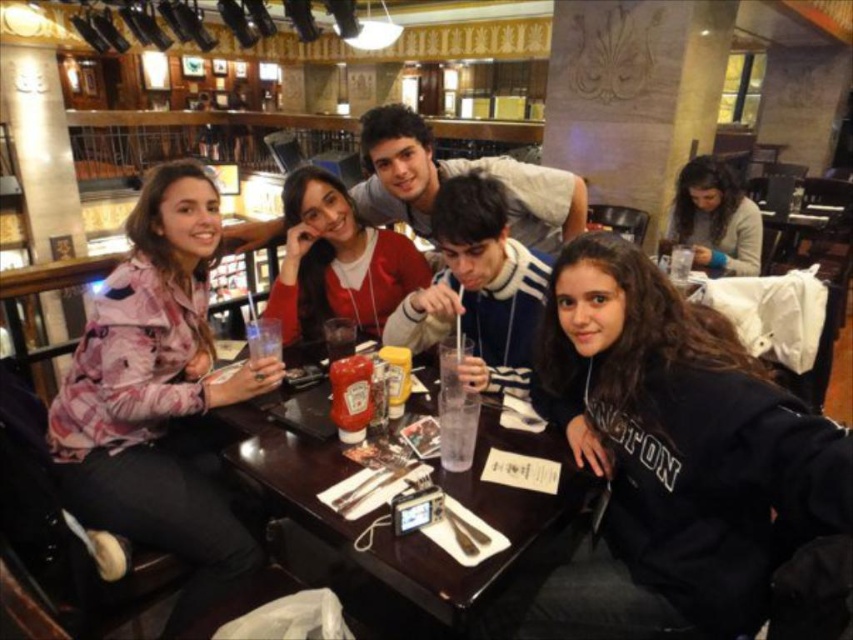
You are taking a photo of the scene and want to focus on both the point at coordinates point (440, 346) and the point at coordinates point (277, 344). Which point should you focus on first to ensure both are in focus?

You should focus on point (440, 346) first because it is closer to the camera than point (277, 344). By focusing on the closer point, the depth of field may also keep the farther point in focus.

You are a waiter in the restaurant and need to reach the clear glass water at table center without touching the white cotton shirt at center. Is this possible?

The white cotton shirt at center is located above the clear glass water at table center, so reaching the water glass would require moving the shirt out of the way first to avoid contact.

You are a photographer at the restaurant and want to take a photo of the translucent plastic cup at center without the dark brown hair at upper right blocking it. What should you do?

Move the dark brown hair at upper right away from the translucent plastic cup at center since it is currently positioned over it, blocking the view.